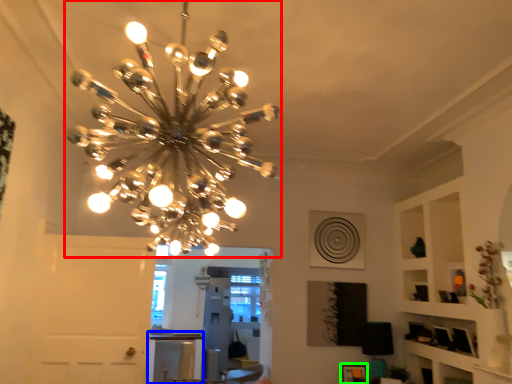
Question: Which object is the closest to the lamp (highlighted by a red box)? Choose among these: table (highlighted by a blue box) or picture frame (highlighted by a green box).

Choices:
 (A) table
 (B) picture frame

Answer: (B)